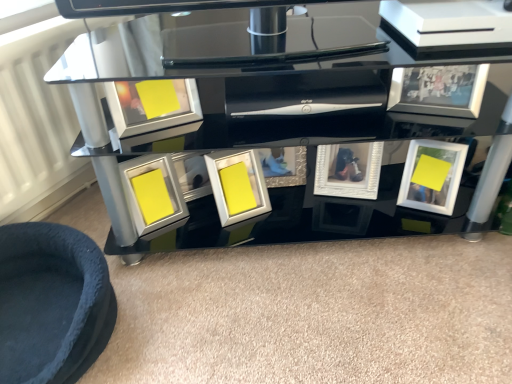
The height and width of the screenshot is (384, 512). In order to click on empty space that is in between white glossy picture frame at center, arranged as the third picture frame when viewed from the left, and white textured frame at center, placed as the fourth picture frame when sorted from left to right in this screenshot , I will do `click(301, 211)`.